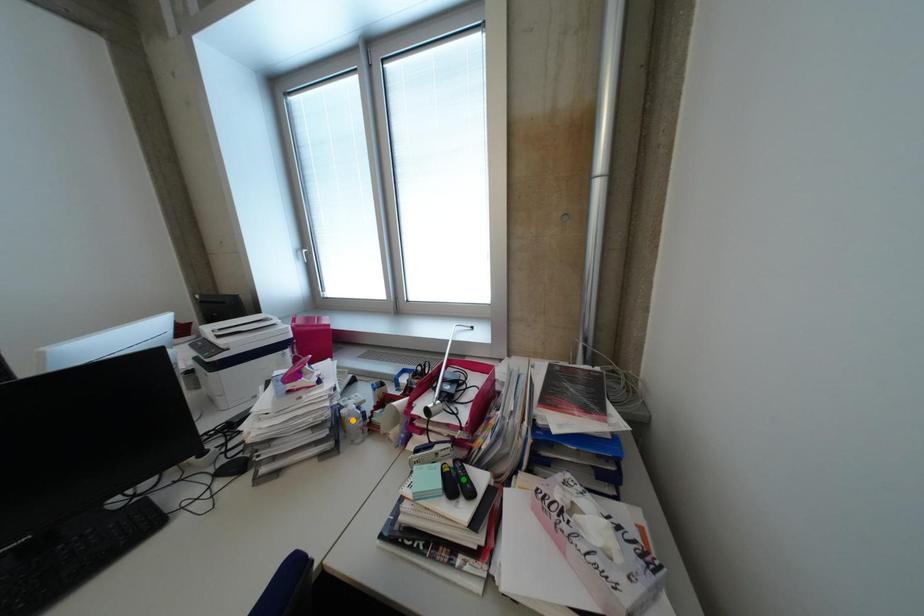
Order these from farthest to nearest:
1. orange point
2. purple point
3. green point

purple point, orange point, green point